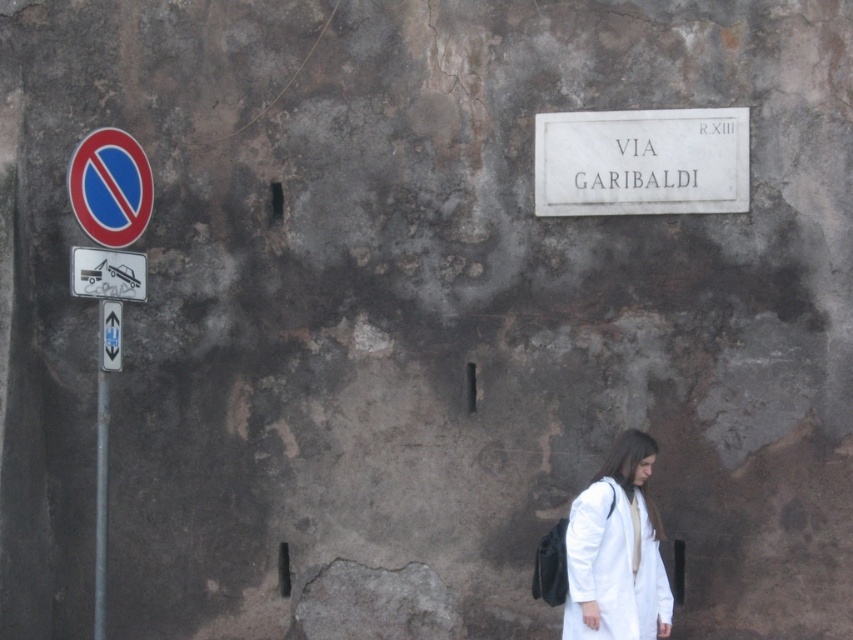
You are standing in front of the white marble sign at upper center and want to place a 10 meter long ladder between it and the nearest sign. Will the ladder fit without overlapping any signs?

The distance between the white marble sign at upper center and the nearest sign is 10.27 meters. Since the ladder is 10 meters long, it will fit between them without overlapping the signs.

In the scene shown: You are a delivery person standing in front of the weathered stone wall with the no parking sign and the pedestrian. You need to place a new rectangular sign that is 1.2 meters tall between the white fabric coat at lower right and the white plastic tow truck at left. Can you fit the sign vertically between them without it overlapping either object?

The white fabric coat at lower right is taller than the white plastic tow truck at left. Since the new sign is 1.2 meters tall, it can be placed vertically between them as long as the vertical space between the two objects is at least 1.2 meters. However, the exact vertical distance isn